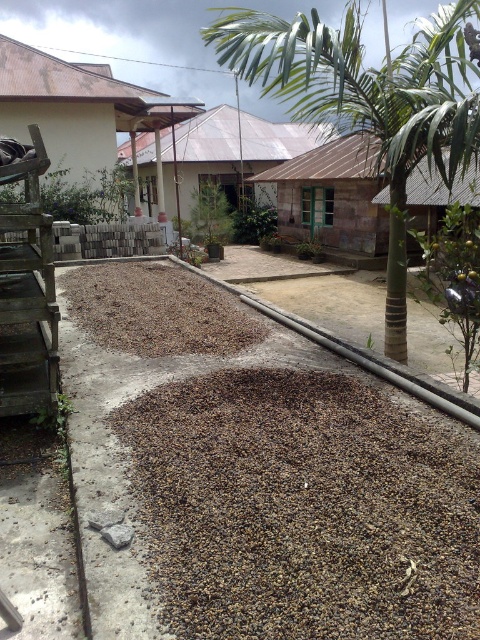
Question: Is dark brown gravel at center positioned before green leafy palm tree at upper center?

Choices:
 (A) yes
 (B) no

Answer: (A)

Question: Among these objects, which one is farthest from the camera?

Choices:
 (A) brown gravel at center
 (B) green leafy palm tree at upper center

Answer: (A)

Question: Among these points, which one is farthest from the camera?

Choices:
 (A) (250, 413)
 (B) (453, 28)
 (C) (216, 301)

Answer: (C)

Question: Is green leafy palm tree at upper center above brown gravel at center?

Choices:
 (A) no
 (B) yes

Answer: (B)

Question: Which of the following is the farthest from the observer?

Choices:
 (A) dark brown gravel at center
 (B) brown gravel at center
 (C) green leafy palm tree at upper center

Answer: (B)

Question: Is dark brown gravel at center below green leafy palm tree at upper center?

Choices:
 (A) yes
 (B) no

Answer: (A)